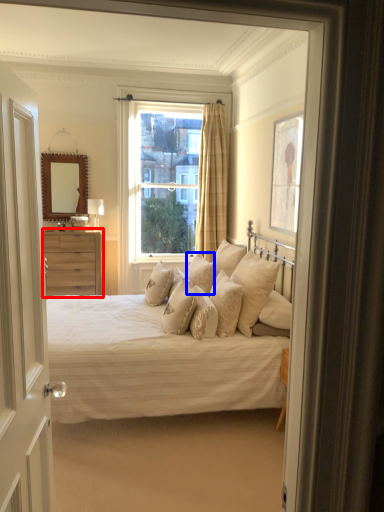
Question: Which object is closer to the camera taking this photo, chest of drawers (highlighted by a red box) or pillow (highlighted by a blue box)?

Choices:
 (A) chest of drawers
 (B) pillow

Answer: (B)